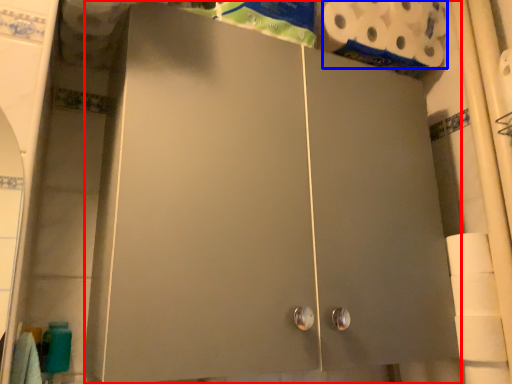
Question: Among these objects, which one is farthest to the camera, cupboard (highlighted by a red box) or toilet paper (highlighted by a blue box)?

Choices:
 (A) cupboard
 (B) toilet paper

Answer: (B)